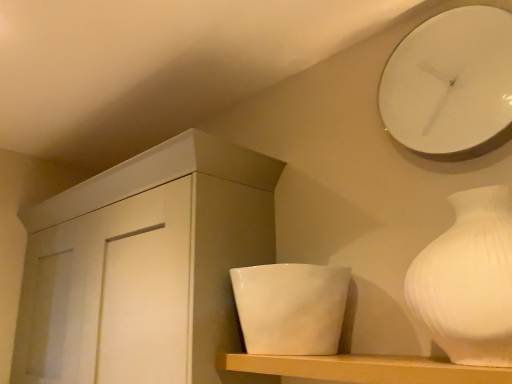
Question: Considering the positions of white matte vase at right and white glossy clock at upper right in the image, is white matte vase at right wider or thinner than white glossy clock at upper right?

Choices:
 (A) thin
 (B) wide

Answer: (B)

Question: From their relative heights in the image, would you say white matte vase at right is taller or shorter than white glossy clock at upper right?

Choices:
 (A) tall
 (B) short

Answer: (B)

Question: Estimate the real-world distances between objects in this image. Which object is farther from the white matte vase at right?

Choices:
 (A) white matte cabinet at center
 (B) white glossy clock at upper right
 (C) white glossy bowl at center
 (D) white matte shelf at center

Answer: (A)

Question: Which object is the closest to the white matte vase at right?

Choices:
 (A) white matte shelf at center
 (B) white glossy clock at upper right
 (C) white matte cabinet at center
 (D) white glossy bowl at center

Answer: (A)